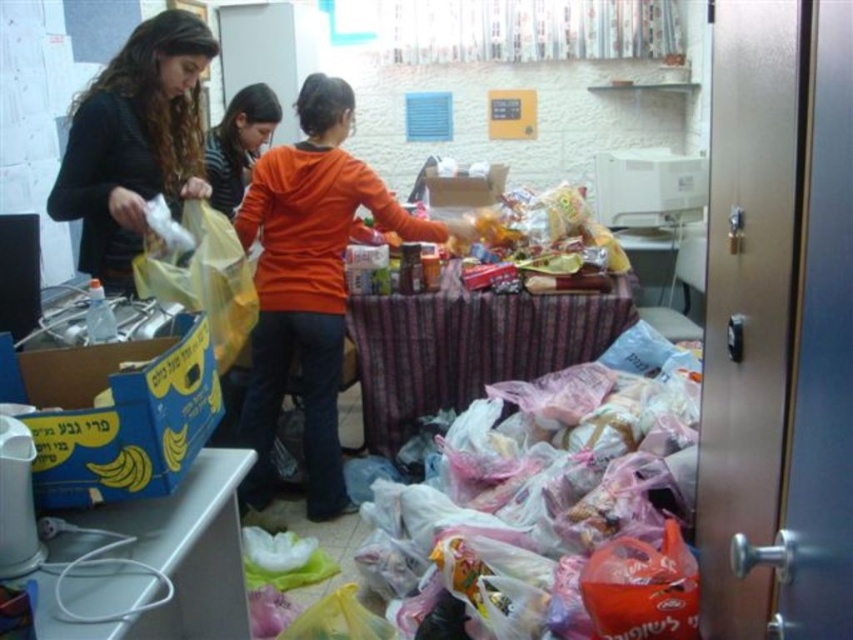
You are organizing items in the storage area and need to stack the orange matte shirt at center and the yellow matte bananas at lower left. Which item should you place at the bottom to ensure stability?

The orange matte shirt at center should be placed at the bottom since it has a greater height than the yellow matte bananas at lower left, providing a more stable base.

You are organizing a community event and need to place an 18 inch wide box on the wooden table at center. The orange matte shirt at center is currently occupying space on the table. Can the box fit on the table without moving the shirt?

The wooden table at center is wider than the orange matte shirt at center, so there is enough space to place the 18 inch wide box on the table without moving the shirt.